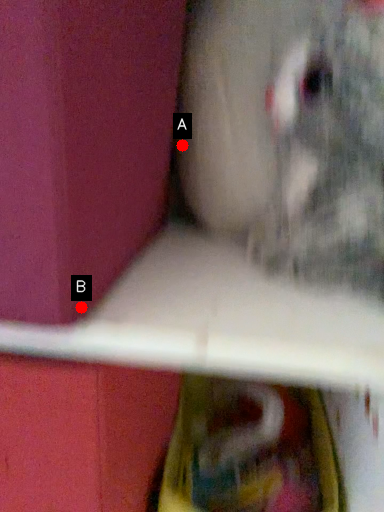
Question: Two points are circled on the image, labeled by A and B beside each circle. Which of the following is the farthest from the observer?

Choices:
 (A) A is further
 (B) B is further

Answer: (A)